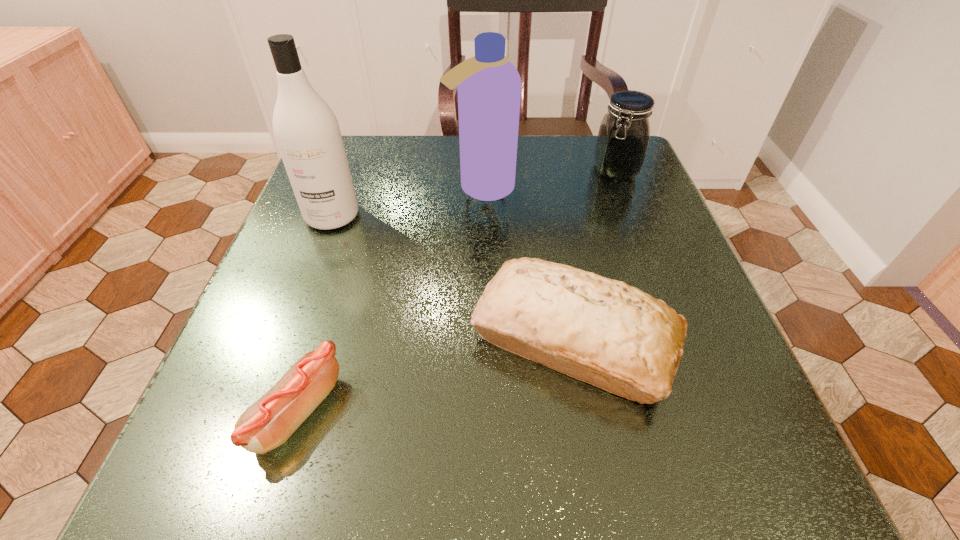
Identify the location of free space between the sausage and the bread. Image resolution: width=960 pixels, height=540 pixels. (436, 374).

Find the location of a particular element. vacant space that is in between the second shortest object and the jar is located at coordinates (594, 254).

Find the location of `free space between the fourth tallest object and the jar`. free space between the fourth tallest object and the jar is located at coordinates (594, 254).

Locate which object is the second closest to the sausage. Please provide its 2D coordinates. Your answer should be formatted as a tuple, i.e. [(x, y)], where the tuple contains the x and y coordinates of a point satisfying the conditions above.

[(306, 130)]

Find the location of a particular element. object that ranks as the third closest to the right shampoo is located at coordinates (614, 336).

You are a GUI agent. You are given a task and a screenshot of the screen. Output one action in this format:
    pyautogui.click(x=<x>, y=<y>)
    Task: Click on the vacant space that satisfies the following two spatial constraints: 1. on the front-facing side of the left shampoo; 2. on the right side of the bread
    This screenshot has width=960, height=540.
    Given the screenshot: What is the action you would take?
    pyautogui.click(x=287, y=338)

You are a GUI agent. You are given a task and a screenshot of the screen. Output one action in this format:
    pyautogui.click(x=<x>, y=<y>)
    Task: Click on the vacant region that satisfies the following two spatial constraints: 1. on the front-facing side of the sausage; 2. on the left side of the left shampoo
    This screenshot has height=540, width=960.
    Given the screenshot: What is the action you would take?
    pyautogui.click(x=260, y=410)

Find the location of `vacant region that satisfies the following two spatial constraints: 1. on the back side of the right shampoo; 2. on the right side of the shortest object`. vacant region that satisfies the following two spatial constraints: 1. on the back side of the right shampoo; 2. on the right side of the shortest object is located at coordinates (367, 188).

Image resolution: width=960 pixels, height=540 pixels. I want to click on vacant point that satisfies the following two spatial constraints: 1. on the front-facing side of the left shampoo; 2. on the left side of the bread, so click(287, 338).